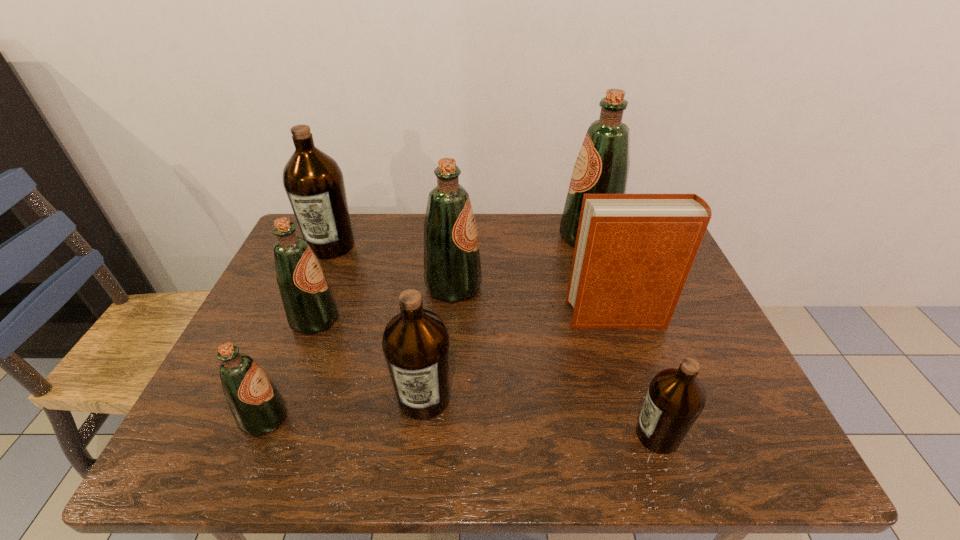
In the image, there is a desktop. What are the coordinates of `free space at the left edge` in the screenshot? It's located at (300, 338).

This screenshot has width=960, height=540. I want to click on free point at the right edge, so tap(738, 379).

This screenshot has width=960, height=540. What are the coordinates of `vacant area at the near left corner of the desktop` in the screenshot? It's located at (249, 455).

At what (x,y) coordinates should I click in order to perform the action: click on empty location between the third biggest green olive oil and the second green olive oil from right to left. Please return your answer as a coordinate pair (x, y). Looking at the image, I should click on (384, 303).

Find the location of a particular element. The width and height of the screenshot is (960, 540). vacant area that lies between the second green olive oil from right to left and the smallest brown olive oil is located at coordinates (556, 361).

In order to click on blank region between the second biggest green olive oil and the third biggest green olive oil in this screenshot , I will do `click(384, 303)`.

At what (x,y) coordinates should I click in order to perform the action: click on free space that is in between the biggest green olive oil and the rightmost brown olive oil. Please return your answer as a coordinate pair (x, y). This screenshot has width=960, height=540. Looking at the image, I should click on (623, 336).

Find the location of a particular element. The width and height of the screenshot is (960, 540). free space between the third biggest green olive oil and the second brown olive oil from right to left is located at coordinates (370, 359).

In order to click on free spot between the third smallest green olive oil and the smallest green olive oil in this screenshot , I will do `click(359, 353)`.

This screenshot has height=540, width=960. What are the coordinates of `vacant area that lies between the hardback book and the second brown olive oil from right to left` in the screenshot? It's located at (520, 356).